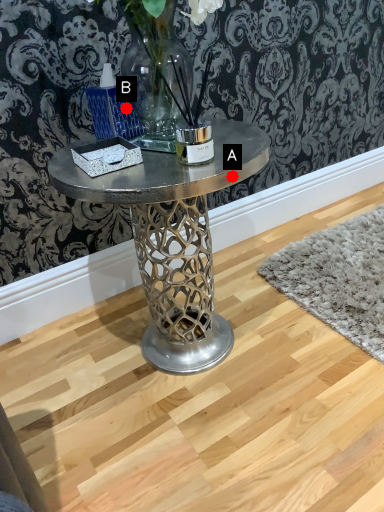
Question: Two points are circled on the image, labeled by A and B beside each circle. Which point is farther from the camera taking this photo?

Choices:
 (A) A is further
 (B) B is further

Answer: (B)